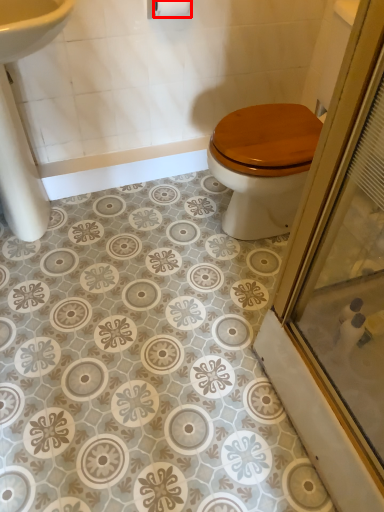
Question: From the image, what is the correct spatial relationship of toilet paper (annotated by the red box) in relation to sink?

Choices:
 (A) left
 (B) right

Answer: (B)